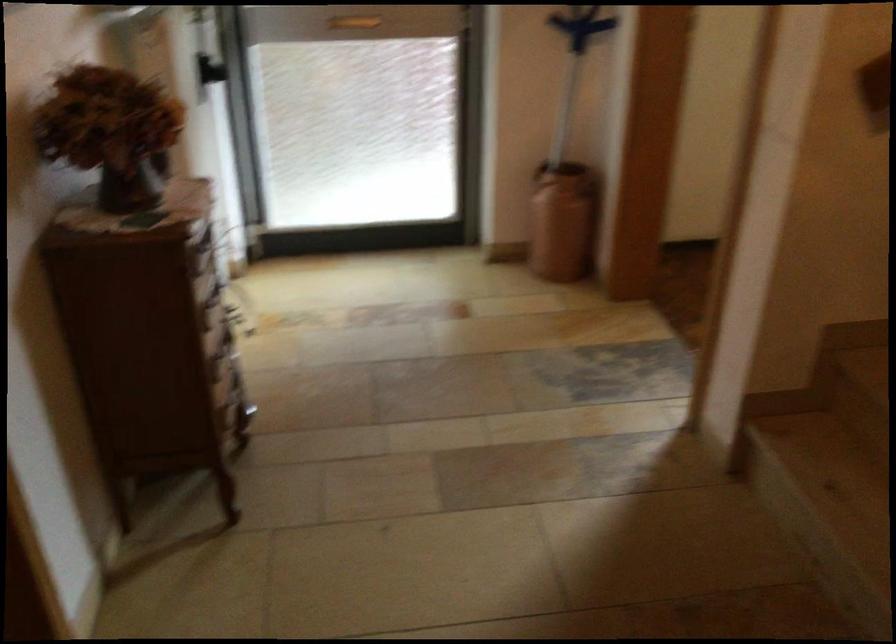
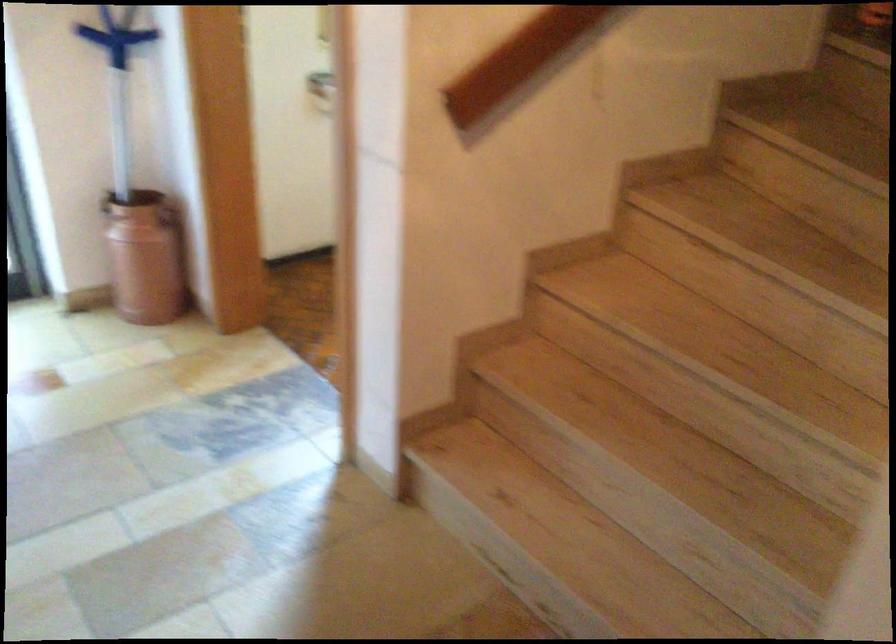
Question: The camera is either moving clockwise (left) or counter-clockwise (right) around the object. The first image is from the beginning of the video and the second image is from the end. Is the camera moving left or right when shooting the video?

Choices:
 (A) Left
 (B) Right

Answer: (A)